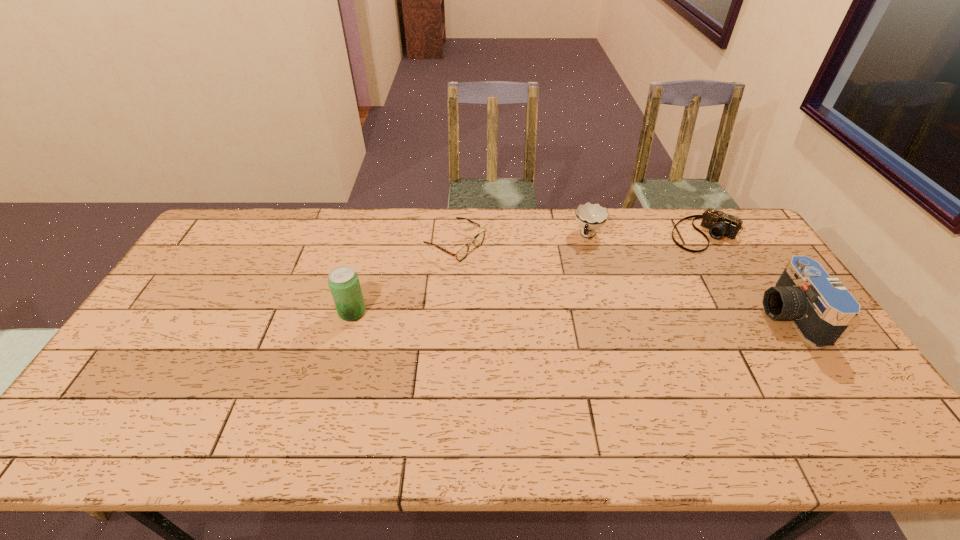
The width and height of the screenshot is (960, 540). I want to click on soda, so click(343, 281).

I want to click on the nearer camera, so click(821, 308).

Locate an element on the screen. The height and width of the screenshot is (540, 960). the second object from left to right is located at coordinates (462, 252).

Where is `the shortest object`? the shortest object is located at coordinates (462, 252).

Locate an element on the screen. This screenshot has width=960, height=540. the shorter camera is located at coordinates (719, 224).

This screenshot has height=540, width=960. What are the coordinates of `the second shortest object` in the screenshot? It's located at (719, 224).

Locate an element on the screen. This screenshot has width=960, height=540. the third object from left to right is located at coordinates (590, 217).

Locate an element on the screen. This screenshot has height=540, width=960. the third tallest object is located at coordinates (590, 217).

Image resolution: width=960 pixels, height=540 pixels. Find the location of `vacant space located on the right of the soda`. vacant space located on the right of the soda is located at coordinates (443, 312).

The width and height of the screenshot is (960, 540). Find the location of `blank space located on the front-facing side of the taller camera`. blank space located on the front-facing side of the taller camera is located at coordinates (684, 315).